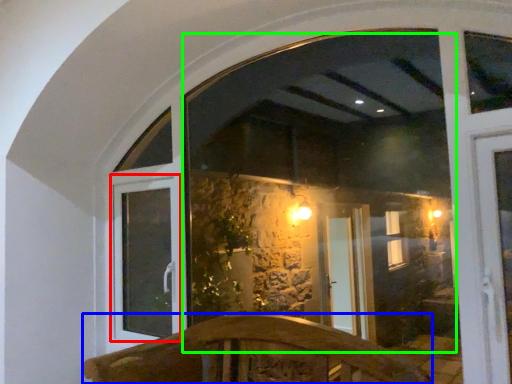
Question: Estimate the real-world distances between objects in this image. Which object is farther from window frame (highlighted by a red box), furniture (highlighted by a blue box) or window screen (highlighted by a green box)?

Choices:
 (A) furniture
 (B) window screen

Answer: (B)